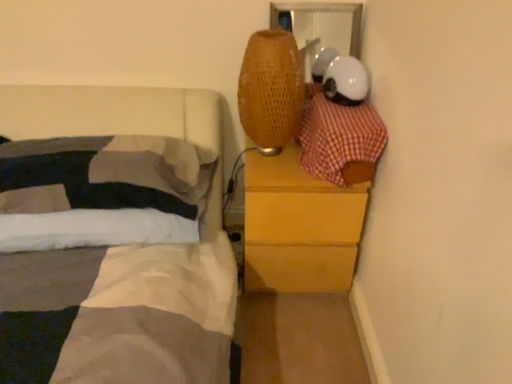
Question: Can you confirm if white soft pillow at left is wider than wooden chest of drawers at right?

Choices:
 (A) yes
 (B) no

Answer: (B)

Question: Considering the relative sizes of white soft pillow at left and wooden chest of drawers at right in the image provided, is white soft pillow at left shorter than wooden chest of drawers at right?

Choices:
 (A) yes
 (B) no

Answer: (A)

Question: Is wooden chest of drawers at right at the back of white soft pillow at left?

Choices:
 (A) yes
 (B) no

Answer: (B)

Question: Can you confirm if white soft pillow at left is positioned to the right of wooden chest of drawers at right?

Choices:
 (A) yes
 (B) no

Answer: (B)

Question: From a real-world perspective, is white soft pillow at left on top of wooden chest of drawers at right?

Choices:
 (A) yes
 (B) no

Answer: (A)

Question: From a real-world perspective, is white soft pillow at left beneath wooden chest of drawers at right?

Choices:
 (A) no
 (B) yes

Answer: (A)

Question: From a real-world perspective, is white soft pillow at left on red checkered fabric at upper right?

Choices:
 (A) no
 (B) yes

Answer: (A)

Question: Is white soft pillow at left behind red checkered fabric at upper right?

Choices:
 (A) yes
 (B) no

Answer: (A)

Question: Is white soft pillow at left located outside red checkered fabric at upper right?

Choices:
 (A) no
 (B) yes

Answer: (B)

Question: Does white soft pillow at left have a lesser height compared to red checkered fabric at upper right?

Choices:
 (A) no
 (B) yes

Answer: (B)

Question: From the image's perspective, is white soft pillow at left below red checkered fabric at upper right?

Choices:
 (A) no
 (B) yes

Answer: (B)

Question: Considering the relative sizes of white soft pillow at left and red checkered fabric at upper right in the image provided, is white soft pillow at left wider than red checkered fabric at upper right?

Choices:
 (A) yes
 (B) no

Answer: (B)

Question: From the image's perspective, does red checkered fabric at upper right appear higher than wooden chest of drawers at right?

Choices:
 (A) yes
 (B) no

Answer: (A)